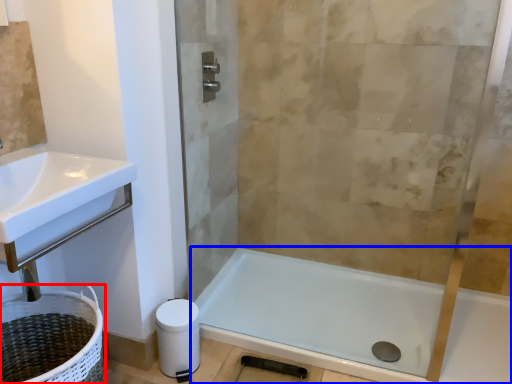
Question: Which of the following is the closest to the observer, laundry basket (highlighted by a red box) or bathtub (highlighted by a blue box)?

Choices:
 (A) laundry basket
 (B) bathtub

Answer: (A)